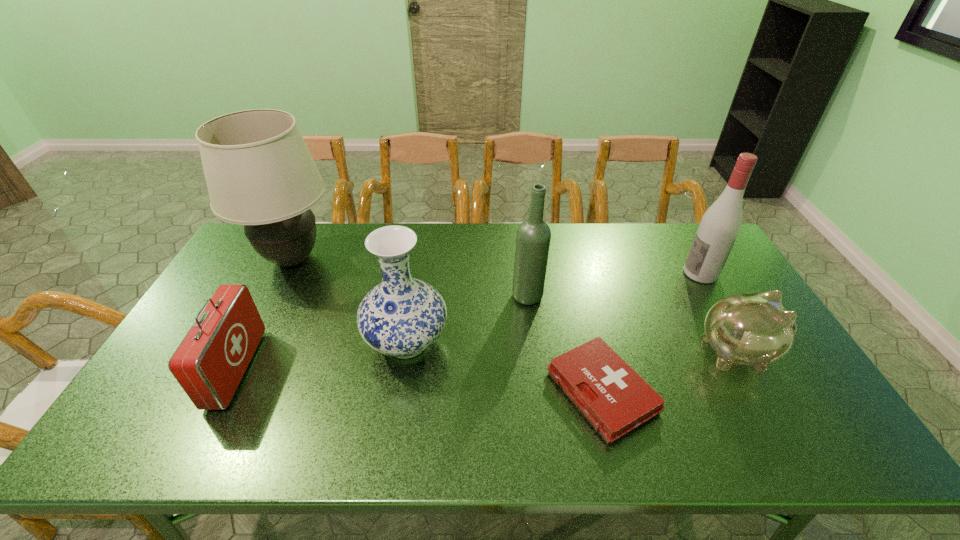
You are a GUI agent. You are given a task and a screenshot of the screen. Output one action in this format:
    pyautogui.click(x=<x>, y=<y>)
    Task: Click on the lampshade situated at the left edge
    The height and width of the screenshot is (540, 960).
    Given the screenshot: What is the action you would take?
    pyautogui.click(x=259, y=171)

I want to click on the first-aid kit that is at the left edge, so click(209, 363).

The image size is (960, 540). I want to click on alcohol situated at the right edge, so click(x=720, y=225).

This screenshot has width=960, height=540. I want to click on piggy bank that is positioned at the right edge, so tap(754, 329).

Where is `object located at the far left corner`? object located at the far left corner is located at coordinates (259, 171).

Identify the location of object that is at the far right corner. This screenshot has height=540, width=960. (720, 225).

Where is `vacant area at the far edge`? The height and width of the screenshot is (540, 960). vacant area at the far edge is located at coordinates (337, 239).

Where is `free space at the near edge`? This screenshot has width=960, height=540. free space at the near edge is located at coordinates (467, 426).

Identify the location of blank area at the right edge. (808, 408).

Locate an element on the screen. The width and height of the screenshot is (960, 540). blank area at the near right corner is located at coordinates (790, 455).